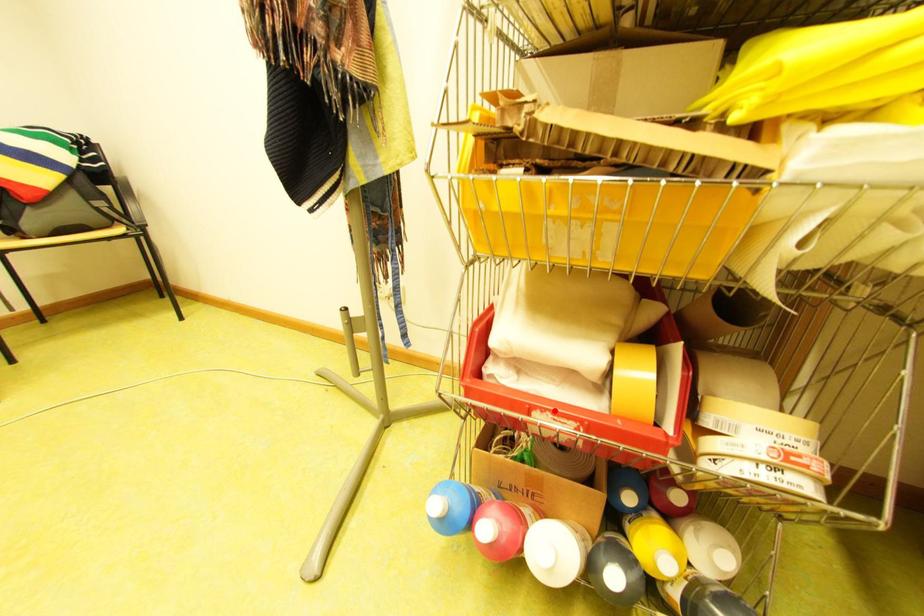
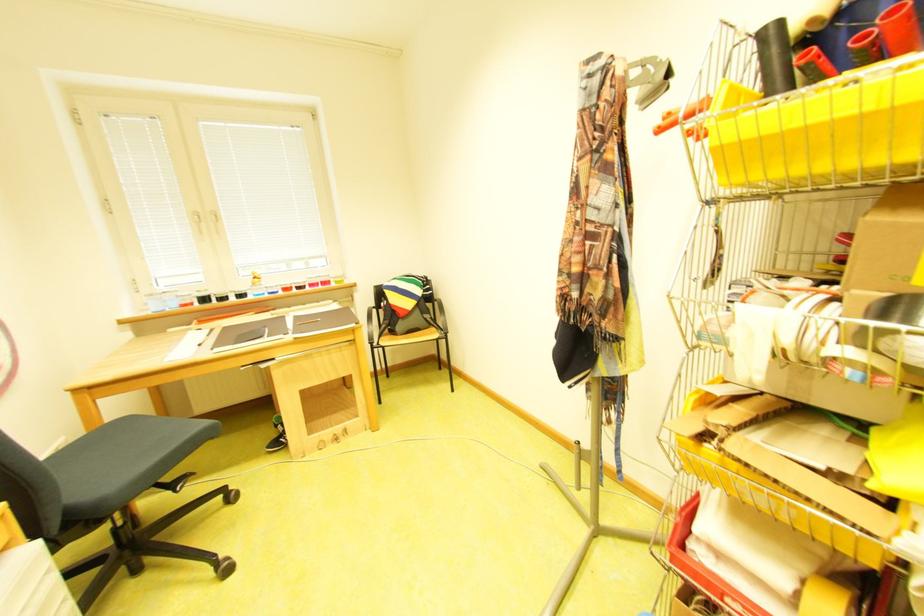
Find the pixel in the second image that matches the highlighted location in the first image.

(746, 600)